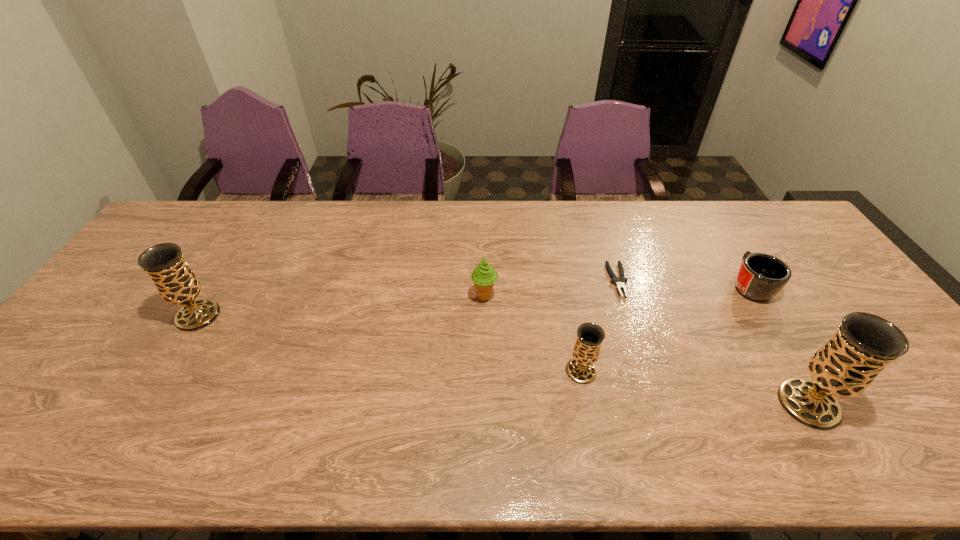
Identify the location of vacant space that's between the third object from left to right and the icecream. This screenshot has height=540, width=960. (533, 334).

Locate an element on the screen. vacant space that is in between the fifth object from right to left and the rightmost chalice is located at coordinates click(647, 350).

What are the coordinates of `free spot between the fourth object from left to right and the rightmost chalice` in the screenshot? It's located at pos(713,342).

In order to click on free spot between the icecream and the rightmost chalice in this screenshot , I will do `click(647, 350)`.

This screenshot has width=960, height=540. In order to click on object that is the closest to the second chalice from left to right in this screenshot , I will do `click(620, 283)`.

Select which object appears as the fifth closest to the mug. Please provide its 2D coordinates. Your answer should be formatted as a tuple, i.e. [(x, y)], where the tuple contains the x and y coordinates of a point satisfying the conditions above.

[(176, 283)]

Locate which chalice ranks second in proximity to the pliers. Please provide its 2D coordinates. Your answer should be formatted as a tuple, i.e. [(x, y)], where the tuple contains the x and y coordinates of a point satisfying the conditions above.

[(864, 344)]

Identify which chalice is the second nearest to the shortest chalice. Please provide its 2D coordinates. Your answer should be formatted as a tuple, i.e. [(x, y)], where the tuple contains the x and y coordinates of a point satisfying the conditions above.

[(176, 283)]

Image resolution: width=960 pixels, height=540 pixels. What are the coordinates of `vacant area in the image that satisfies the following two spatial constraints: 1. on the back side of the leftmost chalice; 2. on the left side of the icecream` in the screenshot? It's located at (209, 298).

What are the coordinates of `free space that satisfies the following two spatial constraints: 1. at the gripping part of the rightmost chalice; 2. on the right side of the shortest object` in the screenshot? It's located at (657, 404).